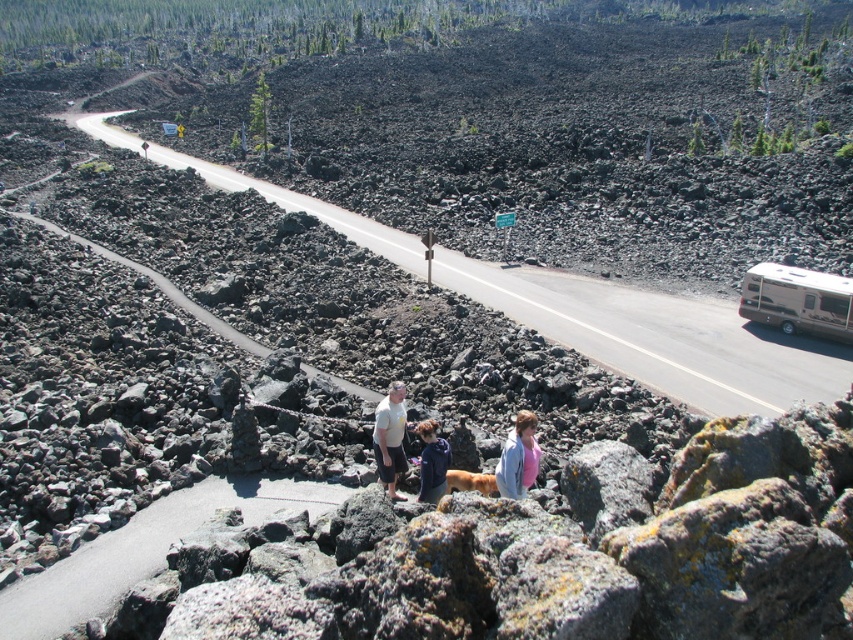
Question: Which of the following is the farthest from the observer?

Choices:
 (A) asphalt road at center
 (B) white matte shirt at center

Answer: (A)

Question: Which point is farther to the camera?

Choices:
 (A) white matte shirt at center
 (B) light blue denim jacket at center
 (C) asphalt road at center

Answer: (C)

Question: Does beige metallic tour bus at right appear on the right side of white matte shirt at center?

Choices:
 (A) yes
 (B) no

Answer: (A)

Question: Considering the real-world distances, which object is farthest from the beige metallic tour bus at right?

Choices:
 (A) asphalt road at center
 (B) white matte shirt at center

Answer: (B)

Question: Where is white matte shirt at center located in relation to light blue denim jacket at center in the image?

Choices:
 (A) above
 (B) below

Answer: (B)

Question: From the image, what is the correct spatial relationship of beige metallic tour bus at right in relation to light blue denim jacket at center?

Choices:
 (A) above
 (B) below

Answer: (A)